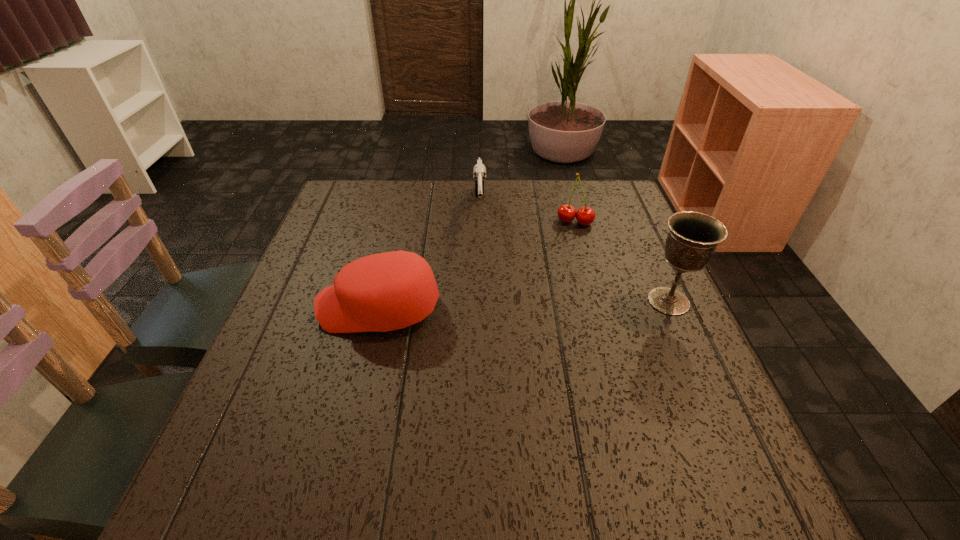
You are a GUI agent. You are given a task and a screenshot of the screen. Output one action in this format:
    pyautogui.click(x=<x>, y=<y>)
    Task: Click on the cap
    The height and width of the screenshot is (540, 960).
    Given the screenshot: What is the action you would take?
    pyautogui.click(x=382, y=292)

This screenshot has height=540, width=960. What are the coordinates of `chalice` in the screenshot? It's located at (693, 237).

This screenshot has width=960, height=540. In order to click on the rightmost object in this screenshot , I will do `click(693, 237)`.

At what (x,y) coordinates should I click in order to perform the action: click on cherry. Please return your answer as a coordinate pair (x, y). The height and width of the screenshot is (540, 960). Looking at the image, I should click on (566, 213).

The width and height of the screenshot is (960, 540). I want to click on the third object from right to left, so click(479, 171).

You are a GUI agent. You are given a task and a screenshot of the screen. Output one action in this format:
    pyautogui.click(x=<x>, y=<y>)
    Task: Click on the vacant space situated on the left of the rightmost object
    This screenshot has height=540, width=960.
    Given the screenshot: What is the action you would take?
    pyautogui.click(x=591, y=301)

The image size is (960, 540). What are the coordinates of `free space located with the stems of the third object from left to right pointing upwards` in the screenshot? It's located at (564, 278).

The image size is (960, 540). What are the coordinates of `free location located with the stems of the third object from left to right pointing upwards` in the screenshot? It's located at (564, 278).

In order to click on vacant space located 0.380m with the stems of the third object from left to right pointing upwards in this screenshot , I will do `click(555, 330)`.

This screenshot has height=540, width=960. I want to click on vacant space situated 0.300m at the muzzle of the second object from left to right, so click(485, 318).